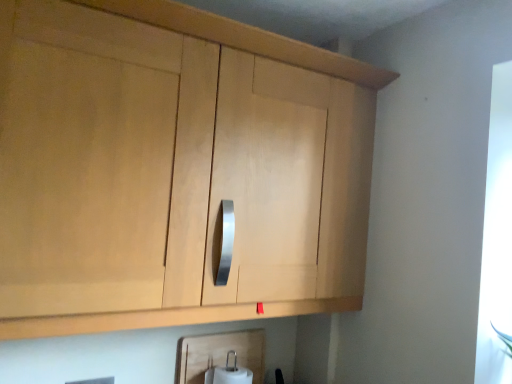
Question: In the image, is white matte toilet paper at lower center on the left side or the right side of light wood cabinet at upper center?

Choices:
 (A) right
 (B) left

Answer: (A)

Question: Considering the positions of white matte toilet paper at lower center and light wood cabinet at upper center in the image, is white matte toilet paper at lower center bigger or smaller than light wood cabinet at upper center?

Choices:
 (A) small
 (B) big

Answer: (A)

Question: Choose the correct answer: Is white matte toilet paper at lower center inside light wood cabinet at upper center or outside it?

Choices:
 (A) outside
 (B) inside

Answer: (A)

Question: In the image, is light wood cabinet at upper center positioned in front of or behind white matte toilet paper at lower center?

Choices:
 (A) behind
 (B) front

Answer: (B)

Question: In terms of width, does light wood cabinet at upper center look wider or thinner when compared to white matte toilet paper at lower center?

Choices:
 (A) wide
 (B) thin

Answer: (A)

Question: From a real-world perspective, is light wood cabinet at upper center positioned above or below white matte toilet paper at lower center?

Choices:
 (A) below
 (B) above

Answer: (B)

Question: From the image's perspective, relative to white matte toilet paper at lower center, is light wood cabinet at upper center above or below?

Choices:
 (A) above
 (B) below

Answer: (A)